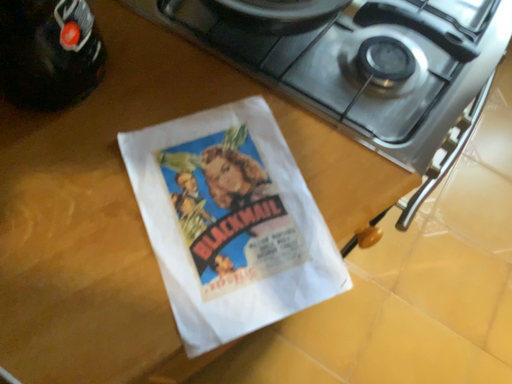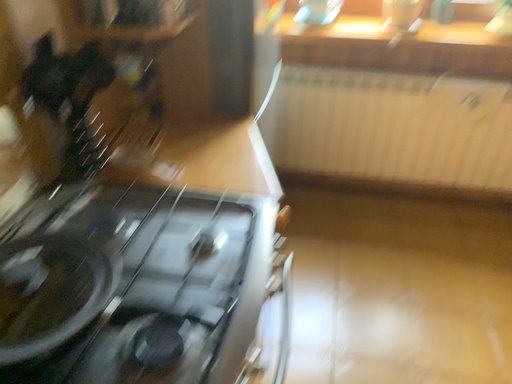
Question: How did the camera likely rotate when shooting the video?

Choices:
 (A) rotated downward
 (B) rotated upward

Answer: (B)